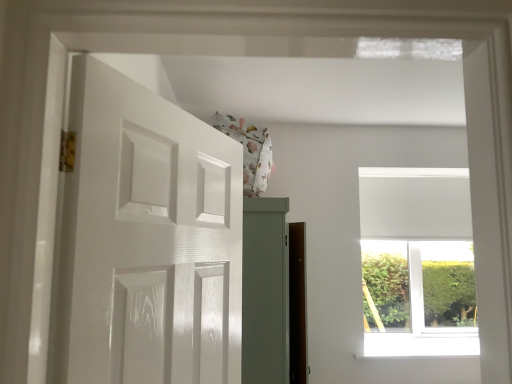
Question: Is white smooth window sill at upper center wider than white glossy door at left?

Choices:
 (A) yes
 (B) no

Answer: (A)

Question: From a real-world perspective, is white smooth window sill at upper center on top of white glossy door at left?

Choices:
 (A) no
 (B) yes

Answer: (A)

Question: Does white smooth window sill at upper center come behind white glossy door at left?

Choices:
 (A) yes
 (B) no

Answer: (A)

Question: Does white smooth window sill at upper center have a greater height compared to white glossy door at left?

Choices:
 (A) yes
 (B) no

Answer: (B)

Question: From a real-world perspective, is white smooth window sill at upper center positioned under white glossy door at left based on gravity?

Choices:
 (A) no
 (B) yes

Answer: (B)

Question: Considering the relative positions of white matte window at upper right and white glossy door at left in the image provided, is white matte window at upper right to the left or to the right of white glossy door at left?

Choices:
 (A) left
 (B) right

Answer: (B)

Question: Which is correct: white matte window at upper right is inside white glossy door at left, or outside of it?

Choices:
 (A) inside
 (B) outside

Answer: (B)

Question: Is point (396, 284) closer or farther from the camera than point (95, 208)?

Choices:
 (A) closer
 (B) farther

Answer: (B)

Question: Considering the positions of white matte window at upper right and white glossy door at left in the image, is white matte window at upper right wider or thinner than white glossy door at left?

Choices:
 (A) wide
 (B) thin

Answer: (A)

Question: Is white smooth window sill at upper center situated inside white glossy door at left or outside?

Choices:
 (A) outside
 (B) inside

Answer: (A)

Question: In terms of size, does white smooth window sill at upper center appear bigger or smaller than white glossy door at left?

Choices:
 (A) small
 (B) big

Answer: (A)

Question: Is white smooth window sill at upper center taller or shorter than white glossy door at left?

Choices:
 (A) short
 (B) tall

Answer: (A)

Question: Is white smooth window sill at upper center in front of or behind white glossy door at left in the image?

Choices:
 (A) front
 (B) behind

Answer: (B)

Question: Is white glossy door at left in front of or behind white matte window at upper right in the image?

Choices:
 (A) front
 (B) behind

Answer: (A)

Question: In terms of height, does white glossy door at left look taller or shorter compared to white matte window at upper right?

Choices:
 (A) short
 (B) tall

Answer: (A)